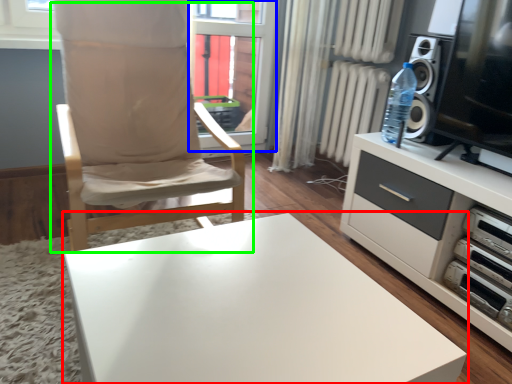
Question: Based on their relative distances, which object is farther from table (highlighted by a red box)? Choose from window screen (highlighted by a blue box) and chair (highlighted by a green box).

Choices:
 (A) window screen
 (B) chair

Answer: (A)